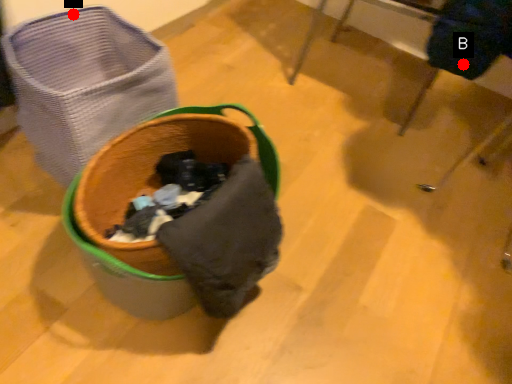
Question: Two points are circled on the image, labeled by A and B beside each circle. Which point is farther to the camera?

Choices:
 (A) A is further
 (B) B is further

Answer: (A)